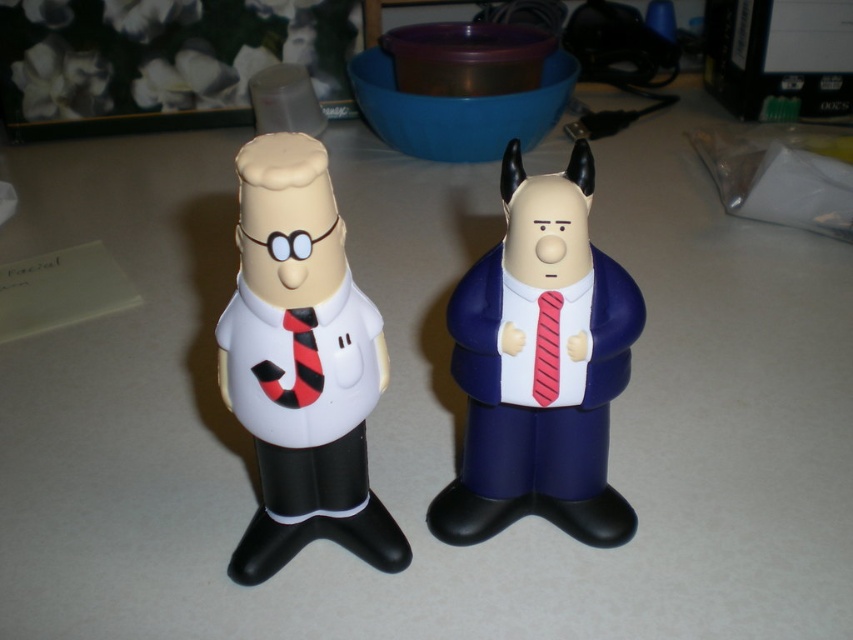
What are the coordinates of the rubberized blue suit at right?

The rubberized blue suit at right is located at coordinates point [532,368].

You are organizing a display of these two figurines on a shelf that can only accommodate items up to 12 inches wide. The rubberized blue suit at right and red striped tie at right are part of the same figurine. Do both elements fit within the shelf width limit?

The rubberized blue suit at right is wider than the red striped tie at right. Since the shelf can hold up to 12 inches, and the widest part of the figurine is the rubberized blue suit at right, it will fit as long as its maximum width is under 12 inches. However, the exact dimensions aren